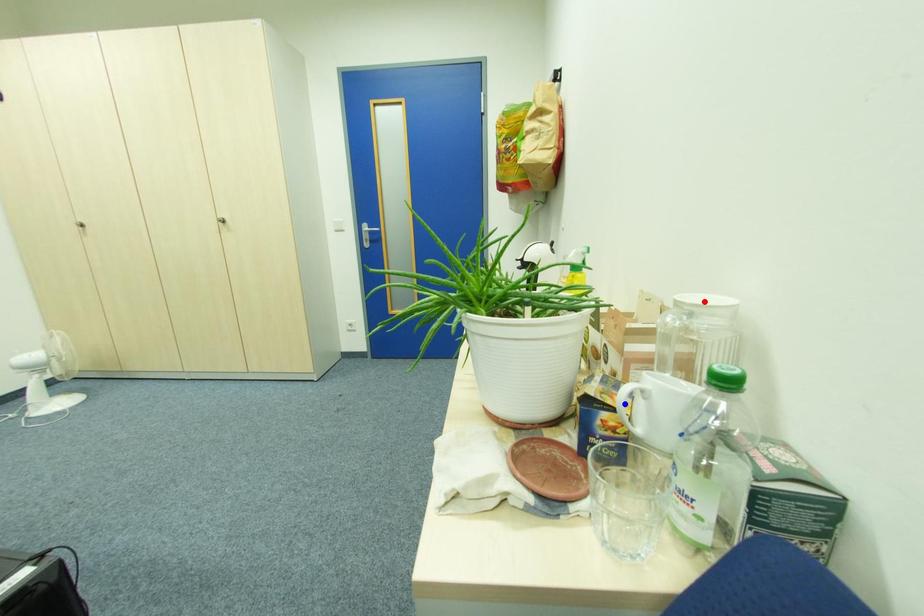
Question: Which of the two points in the image is closer to the camera?

Choices:
 (A) Blue point is closer.
 (B) Red point is closer.

Answer: (B)